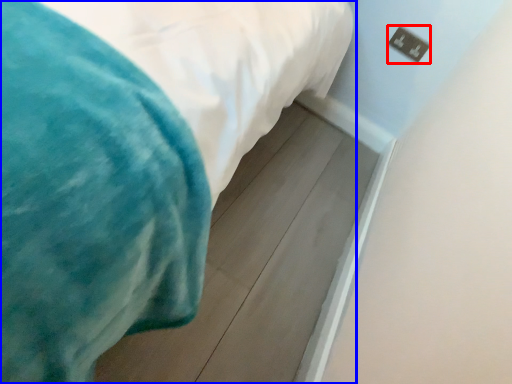
Question: Which object is further to the camera taking this photo, electric outlet (highlighted by a red box) or bed (highlighted by a blue box)?

Choices:
 (A) electric outlet
 (B) bed

Answer: (A)